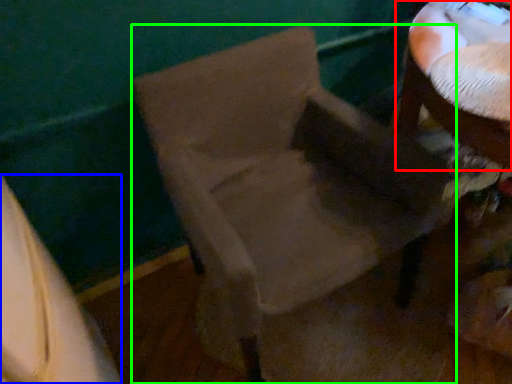
Question: Based on their relative distances, which object is farther from table (highlighted by a red box)? Choose from leftover (highlighted by a blue box) and chair (highlighted by a green box).

Choices:
 (A) leftover
 (B) chair

Answer: (A)